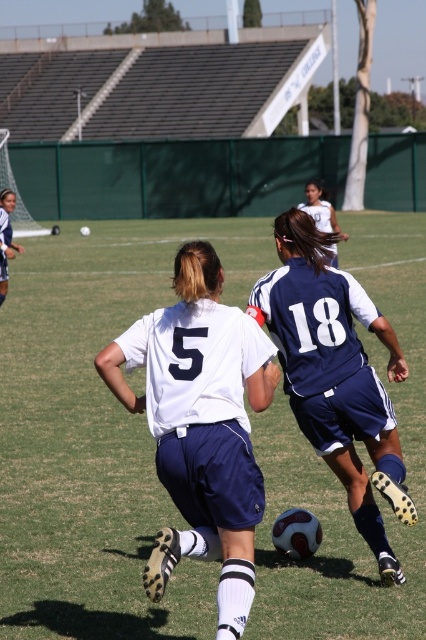
You are a soccer coach analyzing the game. You notice the green grass soccer ball at center and the blue fabric soccer jersey at center. Which object is bigger in size?

The green grass soccer ball at center has a larger size compared to the blue fabric soccer jersey at center.

You are a soccer coach observing the match. You notice two players wearing the white matte jersey at center and the blue fabric soccer jersey at center. Which player has a jersey that is narrower in width?

The white matte jersey at center is thinner than the blue fabric soccer jersey at center, so the player wearing the white matte jersey at center has a narrower jersey.